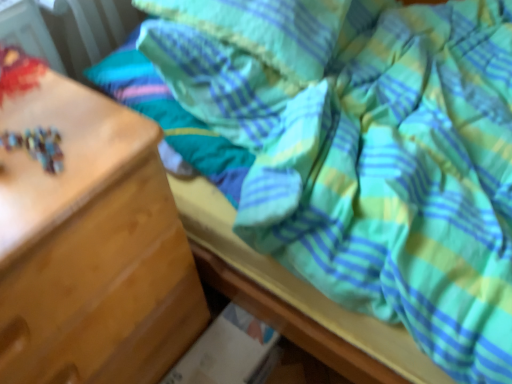
Question: In terms of height, does soft cotton pillow at upper center look taller or shorter compared to wooden chest of drawers at left?

Choices:
 (A) tall
 (B) short

Answer: (B)

Question: Considering the positions of soft cotton pillow at upper center and wooden chest of drawers at left in the image, is soft cotton pillow at upper center bigger or smaller than wooden chest of drawers at left?

Choices:
 (A) big
 (B) small

Answer: (B)

Question: From a real-world perspective, is soft cotton pillow at upper center positioned above or below wooden chest of drawers at left?

Choices:
 (A) above
 (B) below

Answer: (A)

Question: Is wooden chest of drawers at left situated inside soft cotton pillow at upper center or outside?

Choices:
 (A) inside
 (B) outside

Answer: (B)

Question: Considering their positions, is wooden chest of drawers at left located in front of or behind soft cotton pillow at upper center?

Choices:
 (A) front
 (B) behind

Answer: (A)

Question: From their relative heights in the image, would you say wooden chest of drawers at left is taller or shorter than soft cotton pillow at upper center?

Choices:
 (A) short
 (B) tall

Answer: (B)

Question: Would you say wooden chest of drawers at left is to the left or to the right of soft cotton pillow at upper center in the picture?

Choices:
 (A) right
 (B) left

Answer: (B)